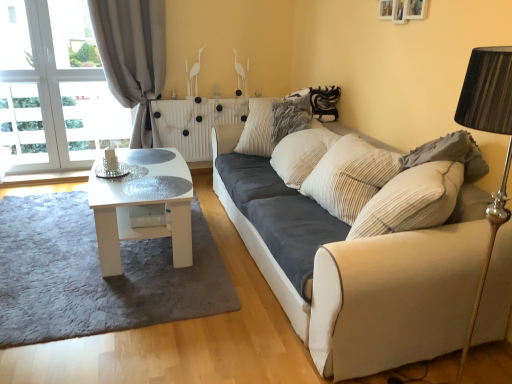
Question: From the image's perspective, relative to gray shaggy rug at lower left, is white glossy coffee table at center above or below?

Choices:
 (A) above
 (B) below

Answer: (A)

Question: From a real-world perspective, relative to gray shaggy rug at lower left, is white glossy coffee table at center vertically above or below?

Choices:
 (A) below
 (B) above

Answer: (B)

Question: Considering the real-world distances, which object is closest to the striped fabric pillow at upper center, which is the second pillow from right to left?

Choices:
 (A) white glossy coffee table at center
 (B) gray fabric curtain at left
 (C) gray shaggy rug at lower left
 (D) white marble radiator at center
 (E) gray textured pillow at right, which is counted as the 1th pillow, starting from the front

Answer: (D)

Question: Which object is positioned closest to the gray fabric curtain at left?

Choices:
 (A) velvet beige couch at center
 (B) gray textured pillow at right, the first pillow in the right-to-left sequence
 (C) white glossy coffee table at center
 (D) striped fabric pillow at upper center, marked as the 1th pillow in a left-to-right arrangement
 (E) gray shaggy rug at lower left

Answer: (C)